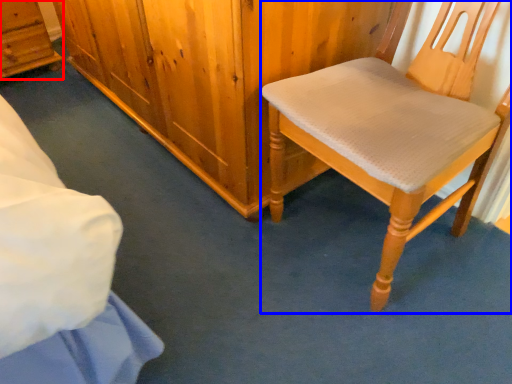
Question: Among these objects, which one is nearest to the camera, cabinetry (highlighted by a red box) or chair (highlighted by a blue box)?

Choices:
 (A) cabinetry
 (B) chair

Answer: (B)